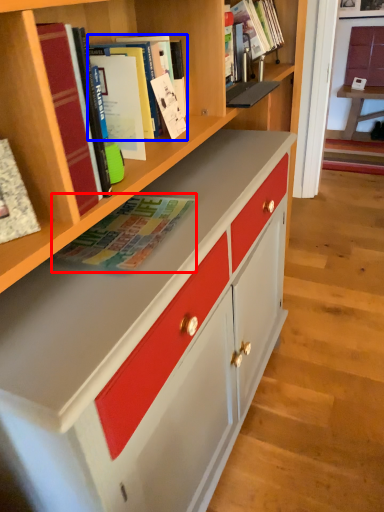
Question: Which point is further to the camera, book (highlighted by a red box) or book (highlighted by a blue box)?

Choices:
 (A) book
 (B) book

Answer: (B)